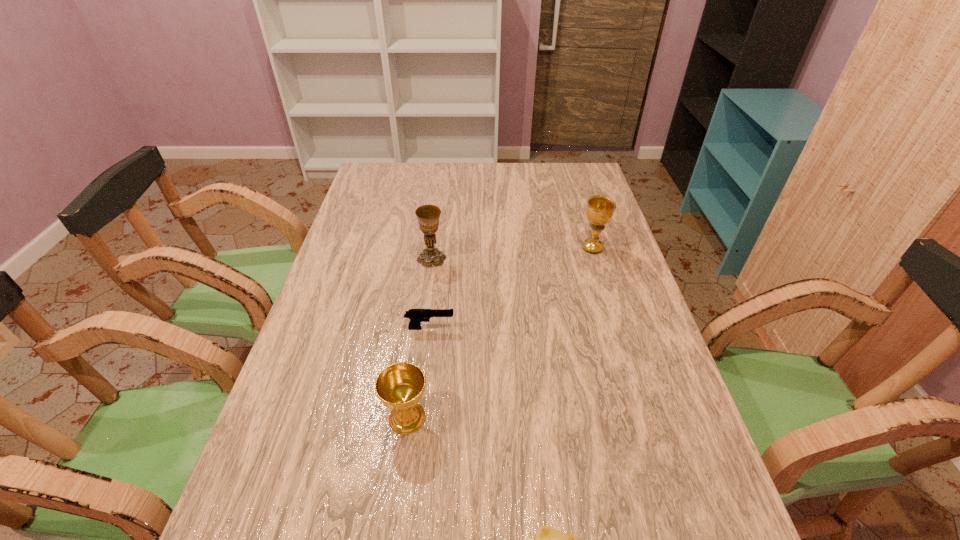
Where is `the rightmost object`? the rightmost object is located at coordinates (600, 209).

Where is `the third tallest object`? Image resolution: width=960 pixels, height=540 pixels. the third tallest object is located at coordinates (400, 386).

You are a GUI agent. You are given a task and a screenshot of the screen. Output one action in this format:
    pyautogui.click(x=<x>, y=<y>)
    Task: Click on the nearest chalice
    The width and height of the screenshot is (960, 540).
    Given the screenshot: What is the action you would take?
    (400, 386)

The width and height of the screenshot is (960, 540). Identify the location of pistol. (416, 316).

This screenshot has width=960, height=540. I want to click on free space located 0.390m on the front of the rightmost object, so click(x=627, y=360).

Where is `vacant position located 0.050m on the back of the shortest chalice`? vacant position located 0.050m on the back of the shortest chalice is located at coordinates (413, 379).

Locate an element on the screen. This screenshot has width=960, height=540. vacant space located on the front-facing side of the third nearest object is located at coordinates (599, 328).

This screenshot has height=540, width=960. Find the location of `object that is at the right edge`. object that is at the right edge is located at coordinates (600, 209).

In the image, there is a desktop. What are the coordinates of `vacant space at the far edge` in the screenshot? It's located at (520, 178).

The image size is (960, 540). In order to click on vacant space at the left edge of the desktop in this screenshot , I will do `click(344, 373)`.